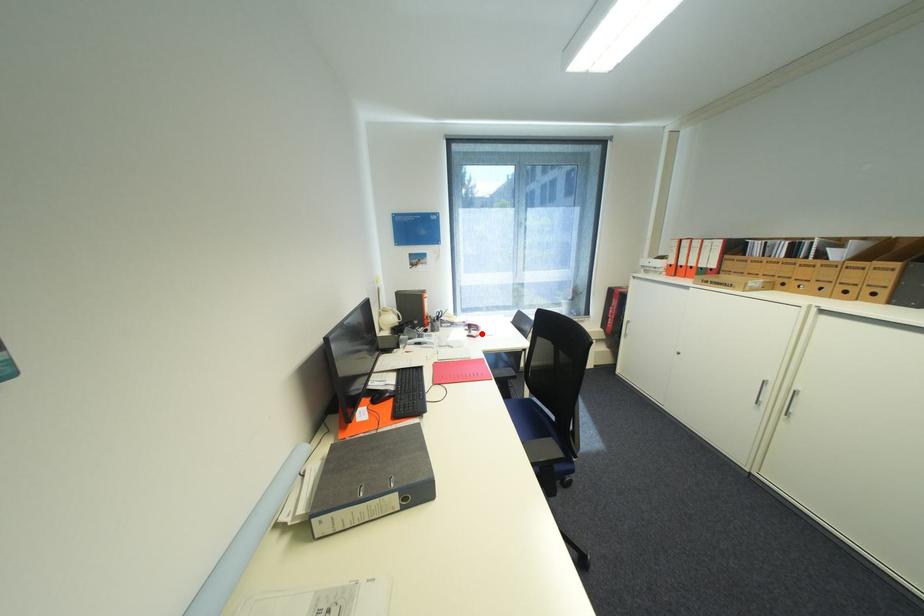
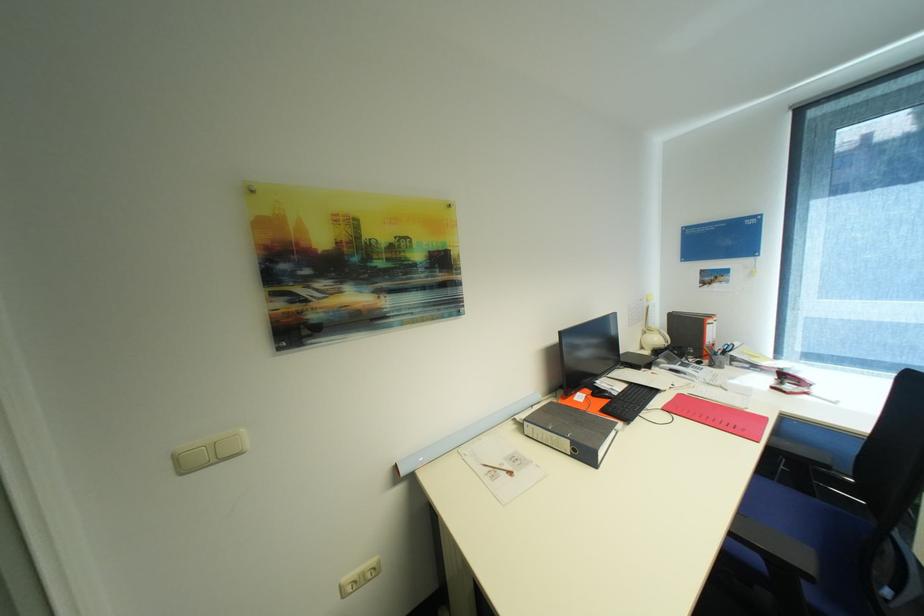
Locate, in the second image, the point that corresponds to the highlighted location in the first image.

(796, 387)